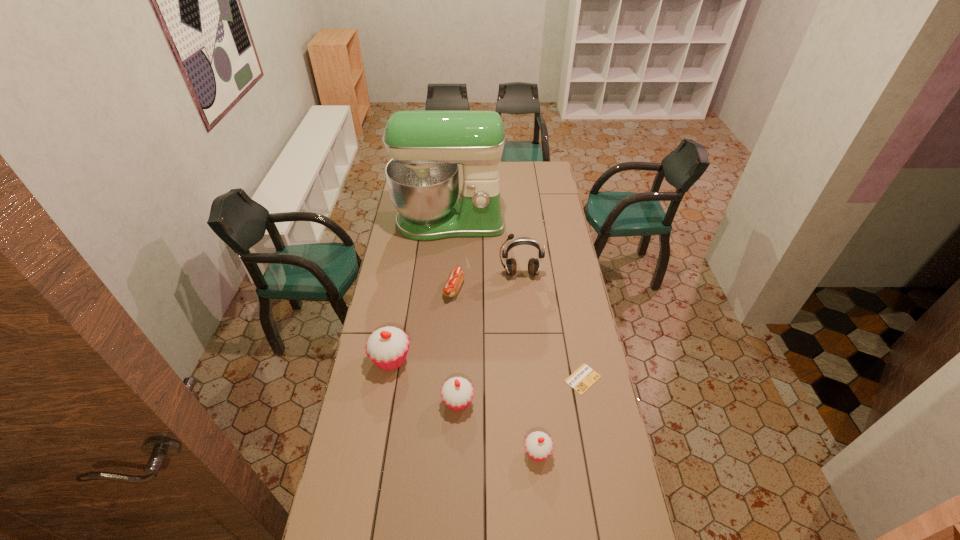
Given the evenly spaced cupcakes in the image, where should an extra cupcake be added on the right to preserve the spacing? Please point to a vacant space. Please provide its 2D coordinates. Your answer should be formatted as a tuple, i.e. [(x, y)], where the tuple contains the x and y coordinates of a point satisfying the conditions above.

[(634, 513)]